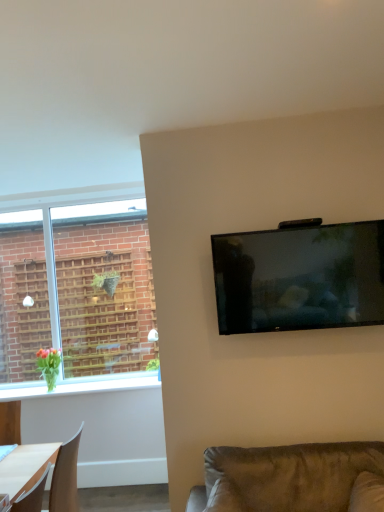
Question: From the image's perspective, would you say matte black tv at upper right is shown under suede-like brown couch at lower right?

Choices:
 (A) yes
 (B) no

Answer: (B)

Question: From the image's perspective, would you say matte black tv at upper right is positioned over suede-like brown couch at lower right?

Choices:
 (A) no
 (B) yes

Answer: (B)

Question: Can you confirm if matte black tv at upper right is positioned to the left of suede-like brown couch at lower right?

Choices:
 (A) yes
 (B) no

Answer: (B)

Question: Can suede-like brown couch at lower right be found inside matte black tv at upper right?

Choices:
 (A) no
 (B) yes

Answer: (A)

Question: Considering the relative sizes of matte black tv at upper right and suede-like brown couch at lower right in the image provided, is matte black tv at upper right wider than suede-like brown couch at lower right?

Choices:
 (A) yes
 (B) no

Answer: (B)

Question: Is matte black tv at upper right positioned behind suede-like brown couch at lower right?

Choices:
 (A) yes
 (B) no

Answer: (A)

Question: Is white glossy window sill at lower left facing away from matte black tv at upper right?

Choices:
 (A) no
 (B) yes

Answer: (A)

Question: Is white glossy window sill at lower left facing towards matte black tv at upper right?

Choices:
 (A) yes
 (B) no

Answer: (B)

Question: Is white glossy window sill at lower left taller than matte black tv at upper right?

Choices:
 (A) yes
 (B) no

Answer: (B)

Question: From the image's perspective, is white glossy window sill at lower left beneath matte black tv at upper right?

Choices:
 (A) yes
 (B) no

Answer: (A)

Question: Can you confirm if white glossy window sill at lower left is shorter than matte black tv at upper right?

Choices:
 (A) yes
 (B) no

Answer: (A)

Question: Is white glossy window sill at lower left positioned far away from matte black tv at upper right?

Choices:
 (A) no
 (B) yes

Answer: (B)

Question: From the image's perspective, is matte black tv at upper right on top of white glossy window sill at lower left?

Choices:
 (A) yes
 (B) no

Answer: (A)